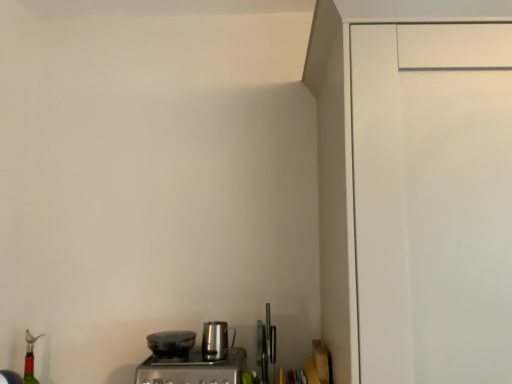
Question: From the image's perspective, is translucent red glass bottle at lower left on top of stainless steel coffee maker at lower center?

Choices:
 (A) no
 (B) yes

Answer: (A)

Question: Can you confirm if translucent red glass bottle at lower left is wider than stainless steel coffee maker at lower center?

Choices:
 (A) yes
 (B) no

Answer: (B)

Question: Are translucent red glass bottle at lower left and stainless steel coffee maker at lower center located far from each other?

Choices:
 (A) no
 (B) yes

Answer: (A)

Question: Can you confirm if translucent red glass bottle at lower left is shorter than stainless steel coffee maker at lower center?

Choices:
 (A) yes
 (B) no

Answer: (B)

Question: Could you tell me if translucent red glass bottle at lower left is facing stainless steel coffee maker at lower center?

Choices:
 (A) yes
 (B) no

Answer: (B)

Question: Does translucent red glass bottle at lower left touch stainless steel coffee maker at lower center?

Choices:
 (A) yes
 (B) no

Answer: (B)

Question: Is translucent red glass bottle at lower left a part of stainless steel kettle at center, which appears as the first kitchen appliance when viewed from the right?

Choices:
 (A) no
 (B) yes

Answer: (A)

Question: From a real-world perspective, is stainless steel kettle at center, which appears as the first kitchen appliance when viewed from the right, under translucent red glass bottle at lower left?

Choices:
 (A) no
 (B) yes

Answer: (A)

Question: Considering the relative sizes of stainless steel kettle at center, arranged as the 2th kitchen appliance when viewed from the left, and translucent red glass bottle at lower left in the image provided, is stainless steel kettle at center, arranged as the 2th kitchen appliance when viewed from the left, taller than translucent red glass bottle at lower left?

Choices:
 (A) yes
 (B) no

Answer: (B)

Question: Does stainless steel kettle at center, which appears as the first kitchen appliance when viewed from the right, lie in front of translucent red glass bottle at lower left?

Choices:
 (A) no
 (B) yes

Answer: (B)

Question: Is stainless steel kettle at center, arranged as the 2th kitchen appliance when viewed from the left, facing towards translucent red glass bottle at lower left?

Choices:
 (A) no
 (B) yes

Answer: (A)

Question: Considering the relative sizes of stainless steel coffee maker at lower center and translucent red glass bottle at lower left in the image provided, is stainless steel coffee maker at lower center thinner than translucent red glass bottle at lower left?

Choices:
 (A) yes
 (B) no

Answer: (B)